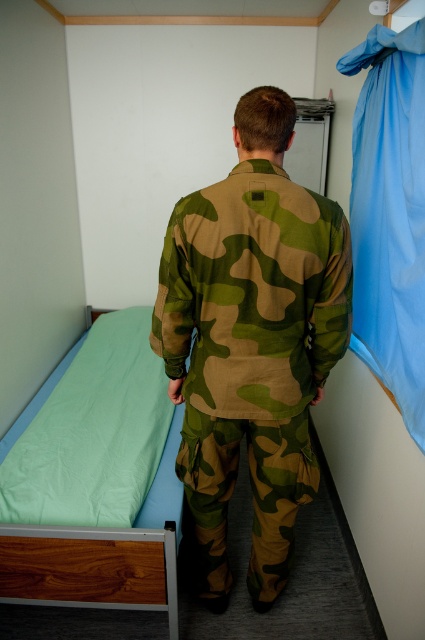
Question: Which point is closer to the camera?

Choices:
 (A) green fabric bed at left
 (B) light blue fabric at upper right

Answer: (B)

Question: Does camouflage fabric uniform at center appear on the right side of light blue fabric at upper right?

Choices:
 (A) yes
 (B) no

Answer: (B)

Question: Does camouflage fabric uniform at center appear over green fabric bed at left?

Choices:
 (A) no
 (B) yes

Answer: (B)

Question: Among these objects, which one is farthest from the camera?

Choices:
 (A) light blue fabric at upper right
 (B) green fabric bed at left

Answer: (B)

Question: Can you confirm if light blue fabric at upper right is positioned to the right of green fabric bed at left?

Choices:
 (A) yes
 (B) no

Answer: (A)

Question: Which object appears farthest from the camera in this image?

Choices:
 (A) light blue fabric at upper right
 (B) green fabric bed at left
 (C) camouflage fabric uniform at center

Answer: (B)